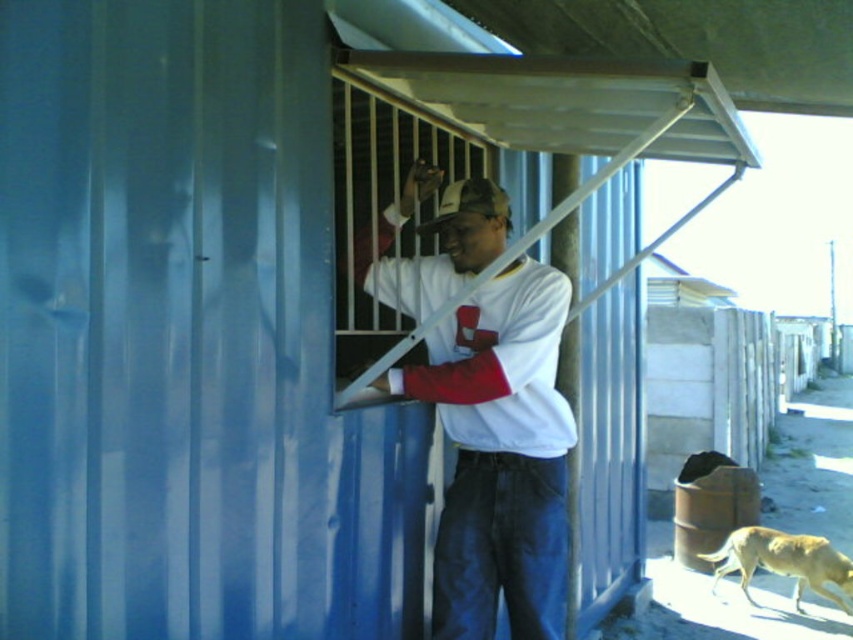
Question: Which point is closer to the camera?

Choices:
 (A) (366, 154)
 (B) (752, 545)
 (C) (549, 509)

Answer: (C)

Question: Considering the real-world distances, which object is farthest from the white matte shirt at center?

Choices:
 (A) golden fur dog at lower right
 (B) white matte window at center

Answer: (A)

Question: Can you confirm if white matte window at center is positioned to the left of golden fur dog at lower right?

Choices:
 (A) no
 (B) yes

Answer: (B)

Question: Does white matte shirt at center have a greater width compared to white matte window at center?

Choices:
 (A) yes
 (B) no

Answer: (A)

Question: Is white matte window at center further to camera compared to golden fur dog at lower right?

Choices:
 (A) yes
 (B) no

Answer: (B)

Question: Based on their relative distances, which object is farther from the white matte shirt at center?

Choices:
 (A) white matte window at center
 (B) golden fur dog at lower right

Answer: (B)